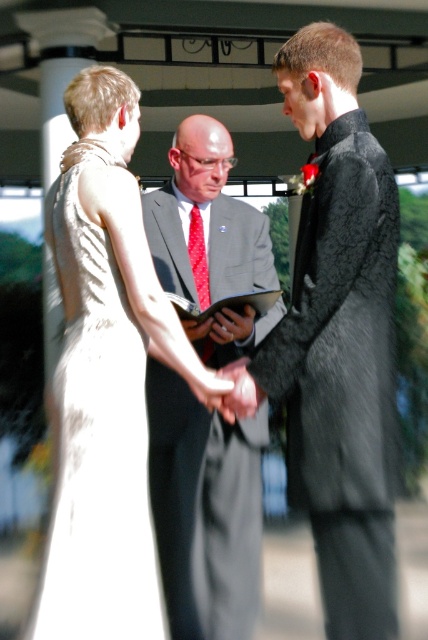
Based on the coordinates provided, which object is located at point (x=338, y=339) in the image?

The black textured suit at center is located at point (x=338, y=339).

You are standing at the point marked by the coordinates point (157, 474). You want to take a photo of the person in the white sleeveless gown from behind. Can you clearly see their face in the photo?

The person in the white sleeveless gown is facing someone out of frame, so their face would not be visible from your position at point (157, 474).